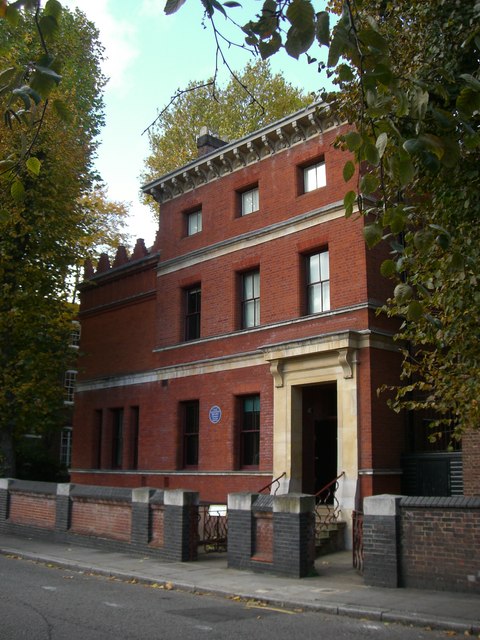
Identify the location of window. (242, 304).